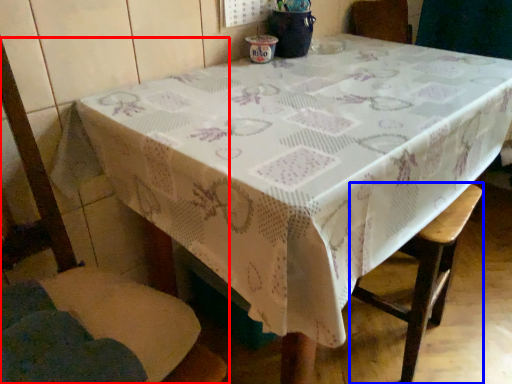
Question: Which of the following is the closest to the observer, chair (highlighted by a red box) or bar stool (highlighted by a blue box)?

Choices:
 (A) chair
 (B) bar stool

Answer: (A)